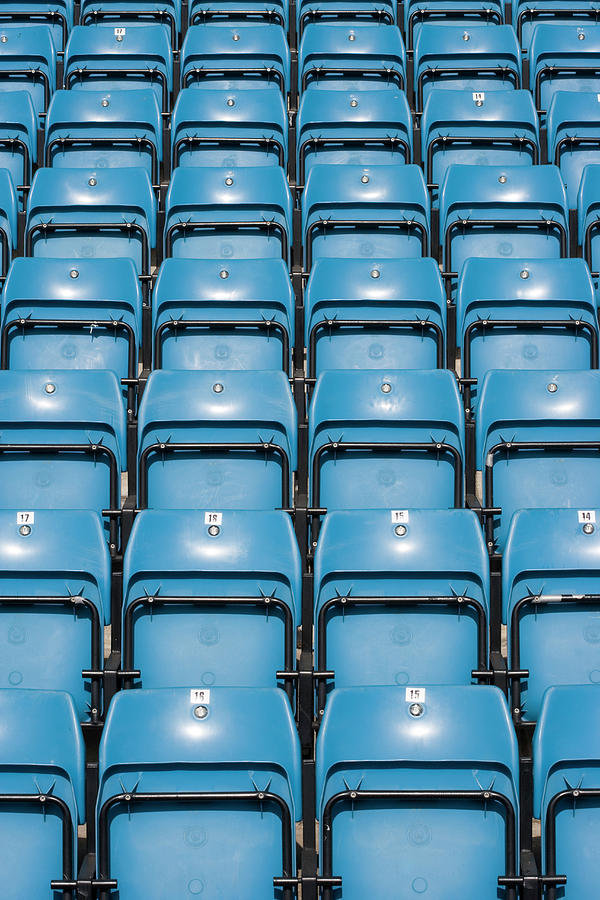
Where is `even numbered seats`? The width and height of the screenshot is (600, 900). even numbered seats is located at coordinates (207, 724), (215, 596), (572, 535), (511, 105).